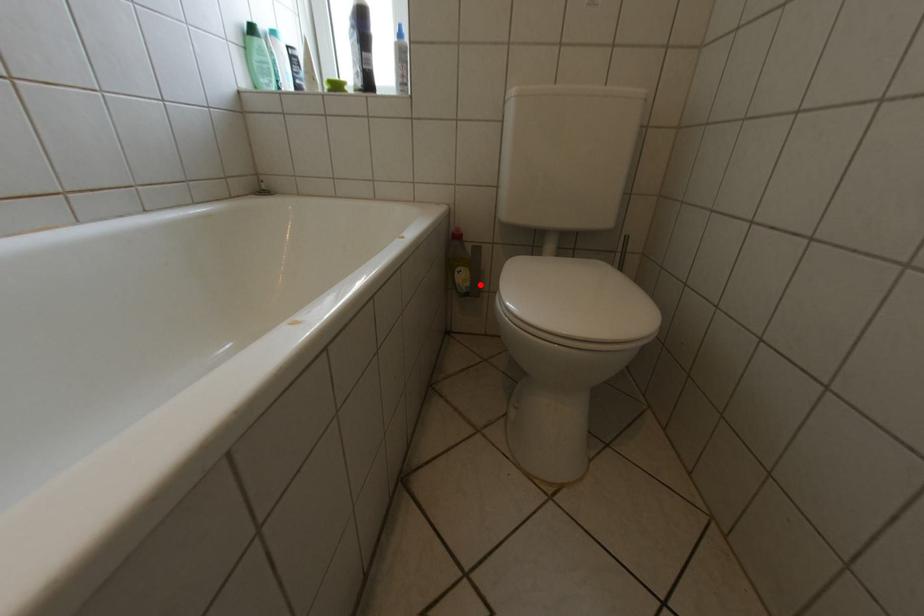
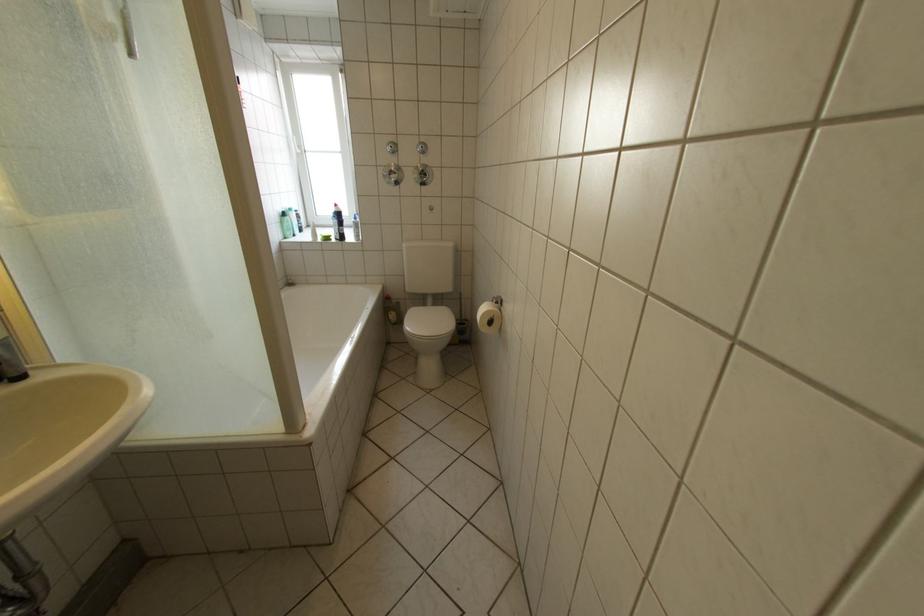
In the second image, find the point that corresponds to the highlighted location in the first image.

(407, 320)